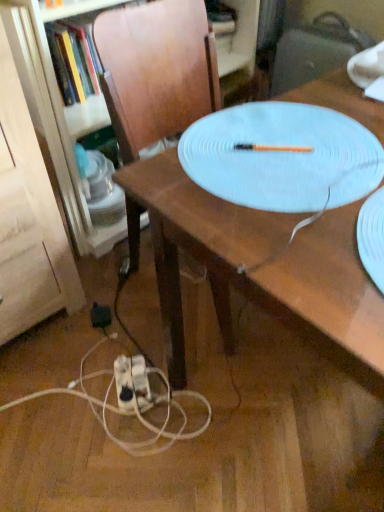
This screenshot has height=512, width=384. What are the coordinates of `vacant space to the left of white plastic extension cord at lower center` in the screenshot? It's located at (77, 387).